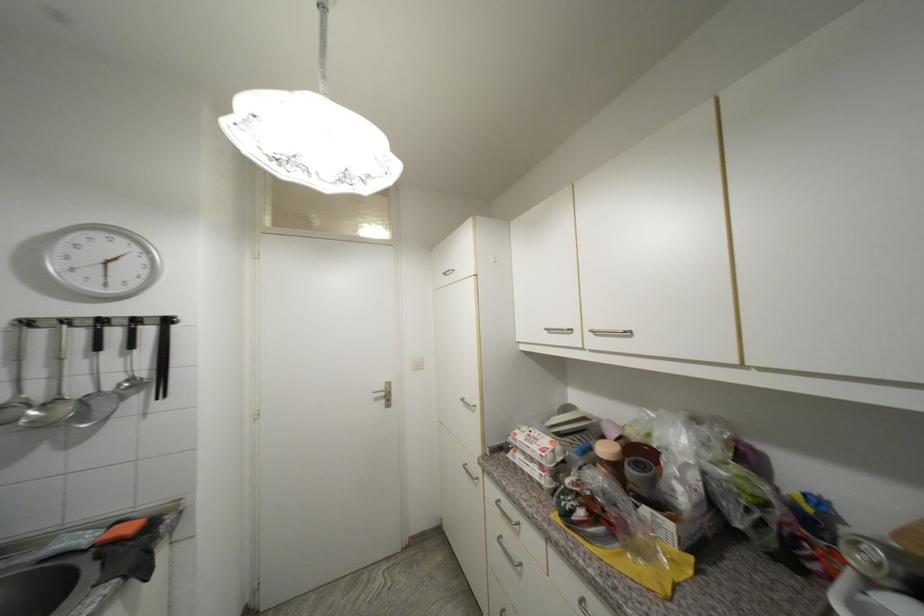
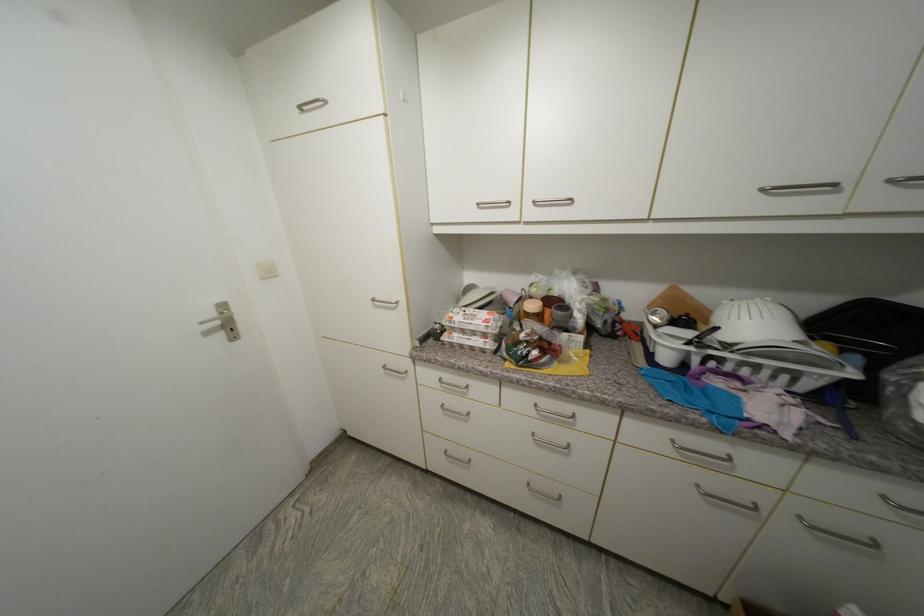
The point at [424,368] is marked in the first image. Where is the corresponding point in the second image?

(274, 275)